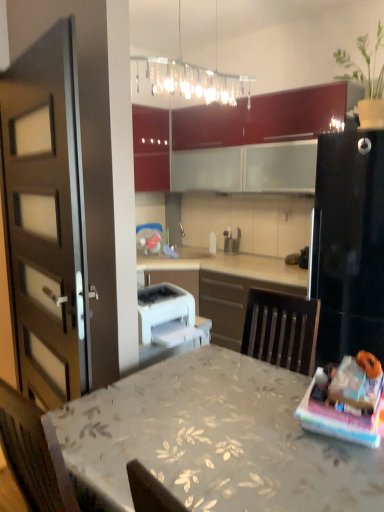
This screenshot has width=384, height=512. What do you see at coordinates (151, 148) in the screenshot? I see `matte red cabinet at upper center, arranged as the 2th cabinetry when viewed from the right` at bounding box center [151, 148].

This screenshot has width=384, height=512. In order to click on metallic silver spice shakers at center, marked as the 2th appliance in a left-to-right arrangement in this screenshot , I will do `click(231, 241)`.

The height and width of the screenshot is (512, 384). What are the coordinates of `white plastic printer at center, the 1th appliance from the left` in the screenshot? It's located at click(x=163, y=307).

What is the approximate height of floral-patterned fabric table at center?

floral-patterned fabric table at center is 31.19 inches in height.

This screenshot has height=512, width=384. What are the coordinates of `glossy wood cabinets at upper center, which appears as the first cabinetry when viewed from the right` in the screenshot? It's located at 264,118.

Identify the location of clear glass light fixture at upper center. This screenshot has height=512, width=384. (188, 75).

What are the coordinates of `matte red cabinet at upper center, positioned as the 1th cabinetry in left-to-right order` in the screenshot? It's located at (151, 148).

Are clear glass light fixture at upper center and glossy wood cabinets at upper center, which appears as the first cabinetry when viewed from the right, located far from each other?

Actually, clear glass light fixture at upper center and glossy wood cabinets at upper center, which appears as the first cabinetry when viewed from the right, are a little close together.

Is point (211, 98) in front of point (244, 128)?

Yes, it is in front of point (244, 128).

Looking at this image, from a real-world perspective, is clear glass light fixture at upper center positioned over glossy wood cabinets at upper center, which appears as the first cabinetry when viewed from the right, based on gravity?

Yes, from a real-world perspective, clear glass light fixture at upper center is on top of glossy wood cabinets at upper center, which appears as the first cabinetry when viewed from the right.

Can you confirm if clear glass light fixture at upper center is thinner than glossy wood cabinets at upper center, which appears as the first cabinetry when viewed from the right?

Incorrect, the width of clear glass light fixture at upper center is not less than that of glossy wood cabinets at upper center, which appears as the first cabinetry when viewed from the right.

Is white plastic printer at center, the 1th appliance from the left, taller or shorter than clear glass light fixture at upper center?

Clearly, white plastic printer at center, the 1th appliance from the left, is shorter compared to clear glass light fixture at upper center.

Can you confirm if white plastic printer at center, placed as the second appliance when sorted from right to left, is thinner than clear glass light fixture at upper center?

Indeed, white plastic printer at center, placed as the second appliance when sorted from right to left, has a lesser width compared to clear glass light fixture at upper center.

At what (x,y) coordinates should I click in order to perform the action: click on appliance lying on the left of clear glass light fixture at upper center. Please return your answer as a coordinate pair (x, y). The height and width of the screenshot is (512, 384). Looking at the image, I should click on (163, 307).

Is point (144, 168) closer or farther from the camera than point (366, 125)?

Point (144, 168) is positioned farther from the camera compared to point (366, 125).

Considering the relative sizes of matte red cabinet at upper center, positioned as the 1th cabinetry in left-to-right order, and green matte plant at upper right in the image provided, is matte red cabinet at upper center, positioned as the 1th cabinetry in left-to-right order, wider than green matte plant at upper right?

Yes, matte red cabinet at upper center, positioned as the 1th cabinetry in left-to-right order, is wider than green matte plant at upper right.

From a real-world perspective, who is located lower, matte red cabinet at upper center, arranged as the 2th cabinetry when viewed from the right, or green matte plant at upper right?

matte red cabinet at upper center, arranged as the 2th cabinetry when viewed from the right, is physically lower.

Is matte red cabinet at upper center, arranged as the 2th cabinetry when viewed from the right, inside or outside of green matte plant at upper right?

matte red cabinet at upper center, arranged as the 2th cabinetry when viewed from the right, cannot be found inside green matte plant at upper right.

Which is behind, matte brown door at left or glossy wood cabinets at upper center, which appears as the first cabinetry when viewed from the right?

glossy wood cabinets at upper center, which appears as the first cabinetry when viewed from the right.

Is matte brown door at left positioned with its back to glossy wood cabinets at upper center, which is the second cabinetry in left-to-right order?

Correct, matte brown door at left is looking away from glossy wood cabinets at upper center, which is the second cabinetry in left-to-right order.

Does matte brown door at left touch glossy wood cabinets at upper center, which appears as the first cabinetry when viewed from the right?

matte brown door at left and glossy wood cabinets at upper center, which appears as the first cabinetry when viewed from the right, are clearly separated.

From the image's perspective, would you say matte brown door at left is positioned over glossy wood cabinets at upper center, which appears as the first cabinetry when viewed from the right?

No.

Do you think metallic silver spice shakers at center, which is the first appliance in top-to-bottom order, is within matte brown door at left, or outside of it?

metallic silver spice shakers at center, which is the first appliance in top-to-bottom order, is outside matte brown door at left.

In the image, is metallic silver spice shakers at center, which is counted as the 2th appliance, starting from the front, positioned in front of or behind matte brown door at left?

metallic silver spice shakers at center, which is counted as the 2th appliance, starting from the front, is positioned farther from the viewer than matte brown door at left.

Between metallic silver spice shakers at center, which is counted as the 2th appliance, starting from the front, and matte brown door at left, which one has less height?

metallic silver spice shakers at center, which is counted as the 2th appliance, starting from the front.

Is matte brown door at left in contact with green matte plant at upper right?

No, matte brown door at left is not beside green matte plant at upper right.

Measure the distance from matte brown door at left to green matte plant at upper right.

matte brown door at left and green matte plant at upper right are 1.77 meters apart.

In the scene shown: Which object is wider, matte brown door at left or green matte plant at upper right?

green matte plant at upper right.

From the image's perspective, would you say matte brown door at left is shown under green matte plant at upper right?

Yes.

Between point (239, 124) and point (240, 230), which one is positioned behind?

The point (240, 230) is farther from the camera.

At what (x,y) coordinates should I click in order to perform the action: click on appliance behind the glossy wood cabinets at upper center, which appears as the first cabinetry when viewed from the right. Please return your answer as a coordinate pair (x, y). The height and width of the screenshot is (512, 384). Looking at the image, I should click on (231, 241).

Does glossy wood cabinets at upper center, which appears as the first cabinetry when viewed from the right, have a lesser width compared to metallic silver spice shakers at center, the 1th appliance in the right-to-left sequence?

In fact, glossy wood cabinets at upper center, which appears as the first cabinetry when viewed from the right, might be wider than metallic silver spice shakers at center, the 1th appliance in the right-to-left sequence.

Between glossy wood cabinets at upper center, which appears as the first cabinetry when viewed from the right, and metallic silver spice shakers at center, which is counted as the 2th appliance, starting from the front, which one has more height?

glossy wood cabinets at upper center, which appears as the first cabinetry when viewed from the right.

From a real-world perspective, starting from the clear glass light fixture at upper center, which cabinetry is the 1st one below it? Please provide its 2D coordinates.

[(264, 118)]

Find the location of a particular element. light fixture above the white plastic printer at center, the 1th appliance from the left (from the image's perspective) is located at coordinates (188, 75).

Looking at this image, estimate the real-world distances between objects in this image. Which object is further from green matte plant at upper right, metallic silver spice shakers at center, which is the first appliance in top-to-bottom order, or floral-patterned fabric table at center?

floral-patterned fabric table at center lies further to green matte plant at upper right than the other object.

Which object lies further to the anchor point green matte plant at upper right, white plastic printer at center, the 1th appliance positioned from the bottom, or metallic silver spice shakers at center, arranged as the first appliance when viewed from the back?

metallic silver spice shakers at center, arranged as the first appliance when viewed from the back, is positioned further to the anchor green matte plant at upper right.

From the image, which object appears to be nearer to white plastic printer at center, placed as the second appliance when sorted from right to left, glossy wood cabinets at upper center, which appears as the first cabinetry when viewed from the right, or matte brown door at left?

matte brown door at left.

When comparing their distances from glossy wood cabinets at upper center, which appears as the first cabinetry when viewed from the right, does metallic silver spice shakers at center, which is the first appliance in top-to-bottom order, or matte red cabinet at upper center, positioned as the 1th cabinetry in left-to-right order, seem further?

metallic silver spice shakers at center, which is the first appliance in top-to-bottom order, lies further to glossy wood cabinets at upper center, which appears as the first cabinetry when viewed from the right, than the other object.

From the image, which object appears to be nearer to metallic silver spice shakers at center, which is the first appliance in top-to-bottom order, glossy wood cabinets at upper center, which is the second cabinetry in left-to-right order, or matte brown door at left?

Among the two, glossy wood cabinets at upper center, which is the second cabinetry in left-to-right order, is located nearer to metallic silver spice shakers at center, which is the first appliance in top-to-bottom order.

Consider the image. Estimate the real-world distances between objects in this image. Which object is closer to green matte plant at upper right, clear glass light fixture at upper center or matte brown door at left?

Among the two, clear glass light fixture at upper center is located nearer to green matte plant at upper right.

Based on their spatial positions, is glossy wood cabinets at upper center, which appears as the first cabinetry when viewed from the right, or metallic silver spice shakers at center, which is the first appliance in top-to-bottom order, closer to matte red cabinet at upper center, arranged as the 2th cabinetry when viewed from the right?

glossy wood cabinets at upper center, which appears as the first cabinetry when viewed from the right, is closer to matte red cabinet at upper center, arranged as the 2th cabinetry when viewed from the right.

Estimate the real-world distances between objects in this image. Which object is further from glossy wood cabinets at upper center, which is the second cabinetry in left-to-right order, clear glass light fixture at upper center or metallic silver spice shakers at center, which is the first appliance in top-to-bottom order?

metallic silver spice shakers at center, which is the first appliance in top-to-bottom order, is positioned further to the anchor glossy wood cabinets at upper center, which is the second cabinetry in left-to-right order.

Identify the location of cabinetry between white plastic printer at center, marked as the 1th appliance in a front-to-back arrangement, and matte red cabinet at upper center, positioned as the 1th cabinetry in left-to-right order, in the front-back direction. (264, 118).

Find the location of a particular element. The width and height of the screenshot is (384, 512). light fixture located between floral-patterned fabric table at center and metallic silver spice shakers at center, which is counted as the 2th appliance, starting from the front, in the depth direction is located at coordinates (188, 75).

Where is `houseplant located between white plastic printer at center, the second appliance from the back, and metallic silver spice shakers at center, marked as the 2th appliance in a left-to-right arrangement, in the depth direction`? The image size is (384, 512). houseplant located between white plastic printer at center, the second appliance from the back, and metallic silver spice shakers at center, marked as the 2th appliance in a left-to-right arrangement, in the depth direction is located at coordinates (366, 80).

You are a GUI agent. You are given a task and a screenshot of the screen. Output one action in this format:
    pyautogui.click(x=<x>, y=<y>)
    Task: Click on the door between floral-patterned fabric table at center and matte red cabinet at upper center, positioned as the 1th cabinetry in left-to-right order, in the front-back direction
    This screenshot has height=512, width=384.
    Given the screenshot: What is the action you would take?
    pyautogui.click(x=47, y=218)